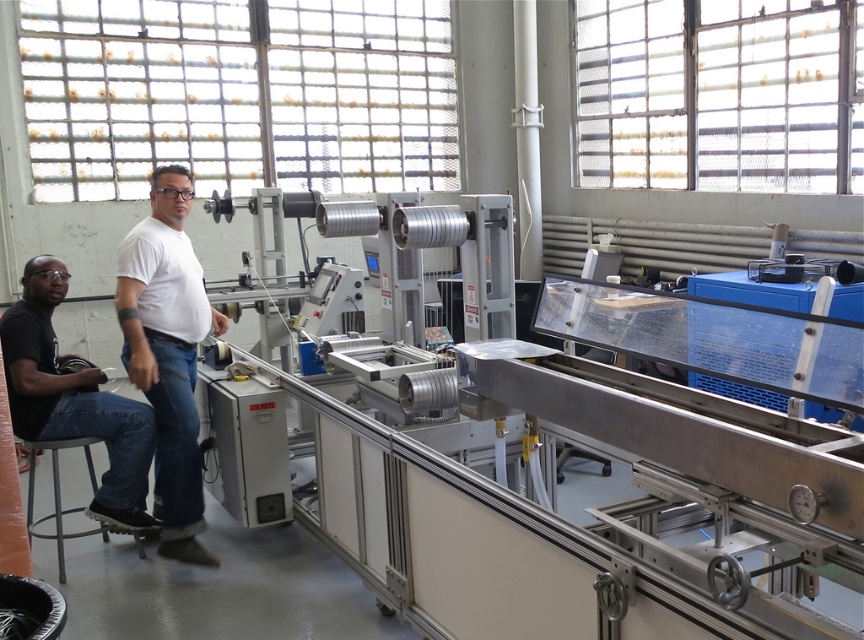
Can you confirm if white matte shirt at center is smaller than black matte shirt at lower left?

Indeed, white matte shirt at center has a smaller size compared to black matte shirt at lower left.

Who is lower down, white matte shirt at center or black matte shirt at lower left?

black matte shirt at lower left

From the picture: Who is more distant from viewer, (189, 468) or (60, 273)?

The point (189, 468) is behind.

The width and height of the screenshot is (864, 640). I want to click on white matte shirt at center, so click(168, 352).